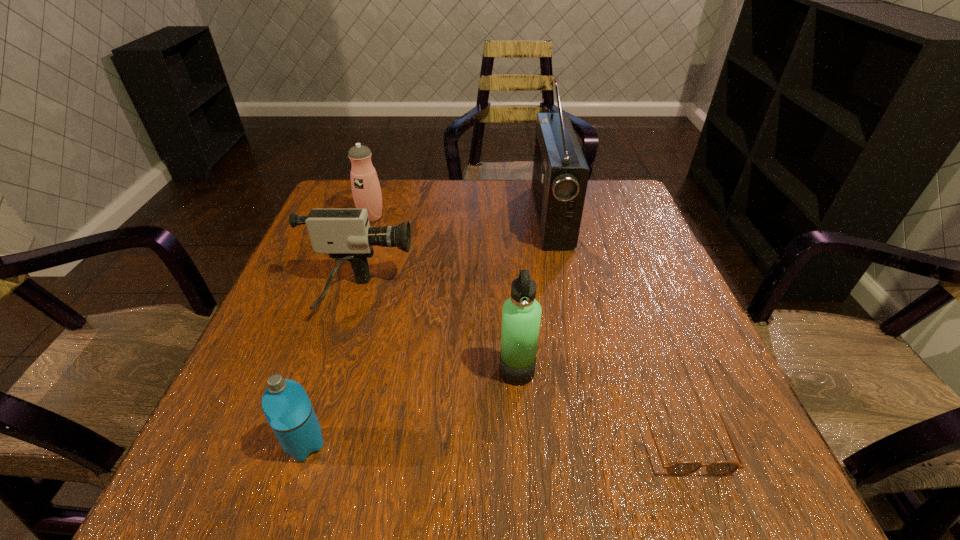
This screenshot has width=960, height=540. Identify the location of camcorder present at the left edge. (345, 234).

The height and width of the screenshot is (540, 960). In order to click on object that is at the right edge in this screenshot , I will do `click(681, 468)`.

Locate an element on the screen. object at the far left corner is located at coordinates click(x=366, y=190).

Identify the location of object located in the near left corner section of the desktop. The height and width of the screenshot is (540, 960). (286, 405).

Find the location of a particular element. object located at the near right corner is located at coordinates (681, 468).

This screenshot has height=540, width=960. I want to click on vacant region at the far edge of the desktop, so click(x=484, y=198).

Locate an element on the screen. vacant area at the near edge of the desktop is located at coordinates (552, 486).

Locate an element on the screen. This screenshot has width=960, height=540. vacant region at the left edge is located at coordinates (300, 279).

Locate an element on the screen. This screenshot has width=960, height=540. vacant space at the right edge is located at coordinates (648, 263).

The height and width of the screenshot is (540, 960). In the image, there is a desktop. What are the coordinates of `blank space at the near left corner` in the screenshot? It's located at tap(251, 468).